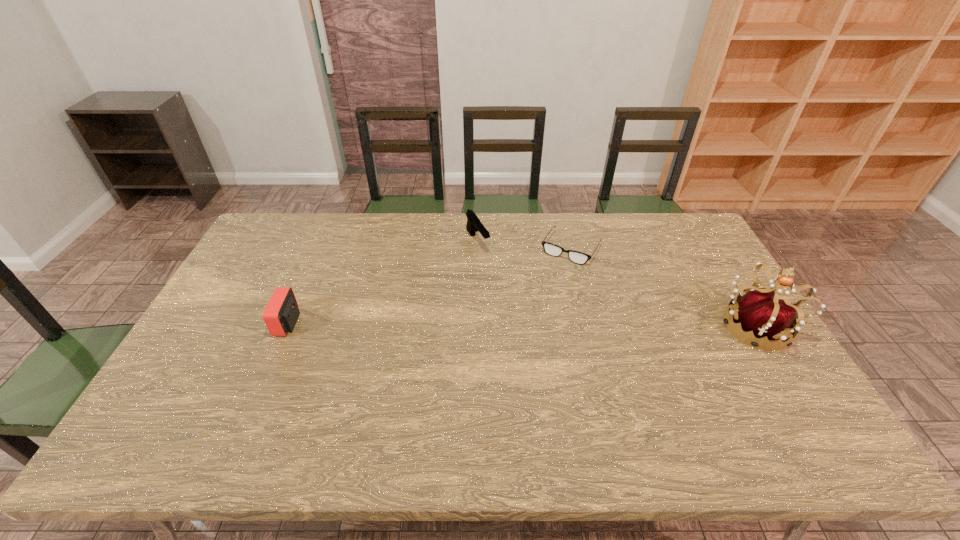
Locate an element on the screen. The height and width of the screenshot is (540, 960). vacant space in between the tallest object and the alarm clock is located at coordinates (521, 325).

Where is `free space between the pistol and the tallest object`? Image resolution: width=960 pixels, height=540 pixels. free space between the pistol and the tallest object is located at coordinates (615, 284).

The height and width of the screenshot is (540, 960). Identify the location of free space between the alarm clock and the tallest object. (521, 325).

Locate an element on the screen. The image size is (960, 540). free space between the shortest object and the alarm clock is located at coordinates (429, 286).

Locate an element on the screen. The image size is (960, 540). free space between the tallest object and the alarm clock is located at coordinates (521, 325).

What are the coordinates of `object that can be found as the third closest to the rightmost object` in the screenshot? It's located at (281, 313).

The width and height of the screenshot is (960, 540). Find the location of `the third closest object to the third object from right to left`. the third closest object to the third object from right to left is located at coordinates (760, 312).

Identify the location of free space in the image that satisfies the following two spatial constraints: 1. on the front side of the shortest object; 2. on the front-facing side of the tallest object. (590, 327).

Identify the location of free point that satisfies the following two spatial constraints: 1. on the front side of the second object from left to right; 2. on the front-facing side of the rightmost object. (476, 327).

In order to click on free space that satisfies the following two spatial constraints: 1. on the front side of the pistol; 2. on the front-facing side of the tiara in this screenshot , I will do `click(476, 327)`.